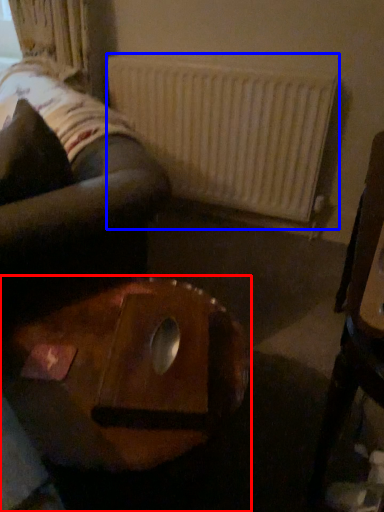
Question: Which of the following is the farthest to the observer, table (highlighted by a red box) or radiator (highlighted by a blue box)?

Choices:
 (A) table
 (B) radiator

Answer: (B)